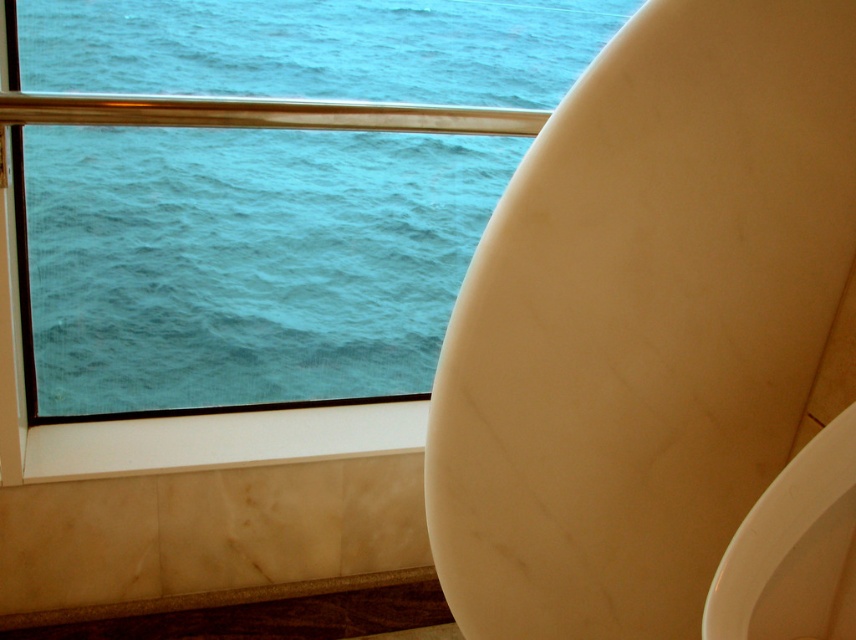
Is white marble urinal at right bigger than metallic gold rail at upper left?

Yes, white marble urinal at right is bigger than metallic gold rail at upper left.

Is the position of white marble urinal at right more distant than that of metallic gold rail at upper left?

No, white marble urinal at right is in front of metallic gold rail at upper left.

Is point (608, 557) behind point (70, 113)?

That is False.

In order to click on white marble urinal at right in this screenshot , I will do `click(645, 323)`.

Is white marble urinal at right bigger than blue water at window left?

Yes.

Who is more distant from viewer, (724, 225) or (336, 385)?

Point (336, 385)

Find the location of a particular element. The width and height of the screenshot is (856, 640). white marble urinal at right is located at coordinates (645, 323).

Is white marble urinal at right closer to the viewer compared to white glossy urinal at lower right?

No, white marble urinal at right is behind white glossy urinal at lower right.

Can you confirm if white marble urinal at right is positioned to the left of white glossy urinal at lower right?

Correct, you'll find white marble urinal at right to the left of white glossy urinal at lower right.

What do you see at coordinates (645, 323) in the screenshot?
I see `white marble urinal at right` at bounding box center [645, 323].

Locate an element on the screen. This screenshot has width=856, height=640. white marble urinal at right is located at coordinates (645, 323).